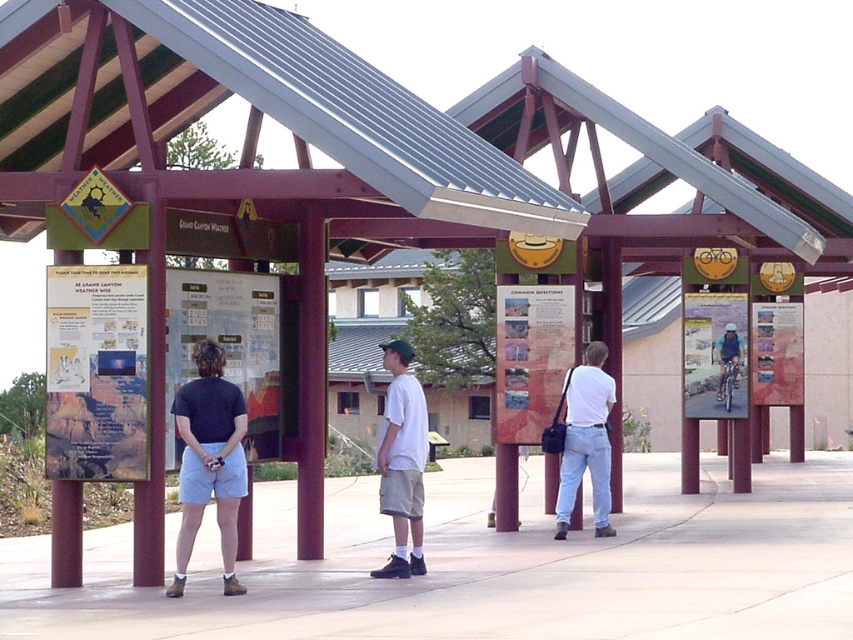
You are a photographer taking a picture of the two people at the kiosks. You notice both the white cotton shirt at center and the white matte shirt at center. Which shirt should you focus on if you want to capture the person with the shorter top?

The white cotton shirt at center is shorter than the white matte shirt at center, so you should focus on the white cotton shirt at center to capture the person with the shorter top.

You are a photographer trying to capture a clear shot of the white cotton shirt at center without the light blue denim shorts at center blocking it. Based on the scene, is this possible?

Answer: The light blue denim shorts at center is in front of the white cotton shirt at center, so it would block the view. To capture the white cotton shirt at center clearly, you need to adjust your angle or move the light blue denim shorts at center out of the way.